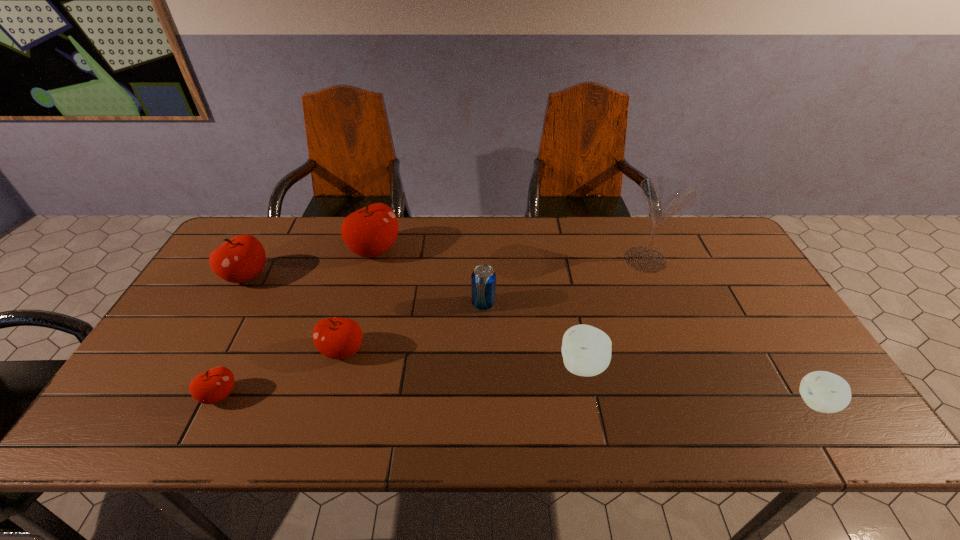
The width and height of the screenshot is (960, 540). What are the coordinates of `vacant space at the right edge of the desktop` in the screenshot? It's located at (777, 339).

The height and width of the screenshot is (540, 960). I want to click on vacant region at the far left corner of the desktop, so click(239, 233).

In the image, there is a desktop. At what (x,y) coordinates should I click in order to perform the action: click on vacant space at the far right corner. Please return your answer as a coordinate pair (x, y). Image resolution: width=960 pixels, height=540 pixels. Looking at the image, I should click on (707, 231).

The image size is (960, 540). I want to click on free space between the bigger white apple and the beer can, so click(x=533, y=335).

Locate an element on the screen. free space between the fourth farthest object and the flute glass is located at coordinates (564, 282).

This screenshot has width=960, height=540. I want to click on free area in between the fourth object from right to left and the third smallest red apple, so click(365, 290).

At what (x,y) coordinates should I click in order to perform the action: click on vacant area that lies between the biggest red apple and the second object from right to left. Please return your answer as a coordinate pair (x, y). The width and height of the screenshot is (960, 540). Looking at the image, I should click on coord(510,255).

What are the coordinates of `empty space between the rightmost apple and the tallest object` in the screenshot? It's located at (x=731, y=331).

Where is `empty space that is in between the rightmost apple and the second nearest red apple`? empty space that is in between the rightmost apple and the second nearest red apple is located at coordinates (580, 377).

This screenshot has width=960, height=540. Find the location of `vacant area between the second tallest object and the smallest red apple`. vacant area between the second tallest object and the smallest red apple is located at coordinates (298, 322).